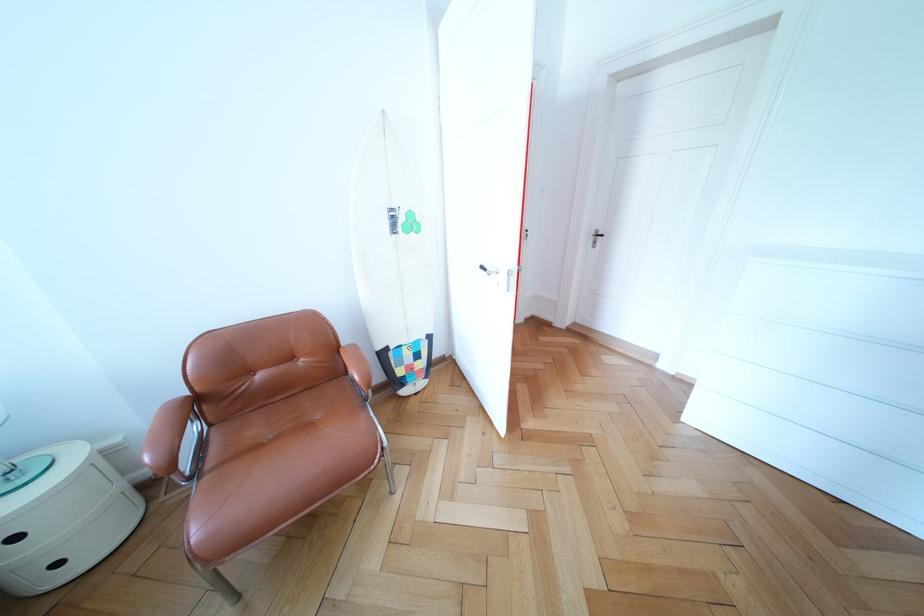
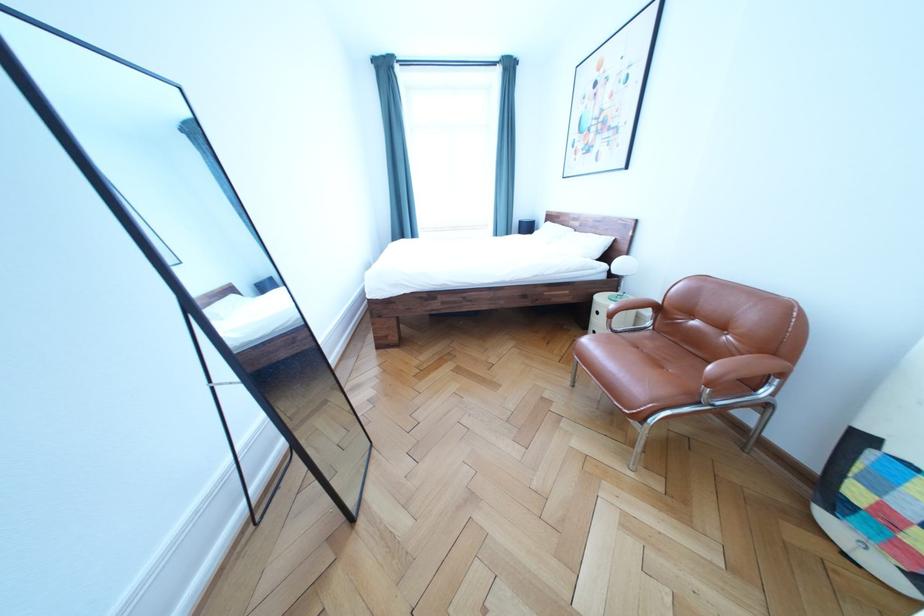
The point at (27, 544) is marked in the first image. Where is the corresponding point in the second image?

(609, 318)